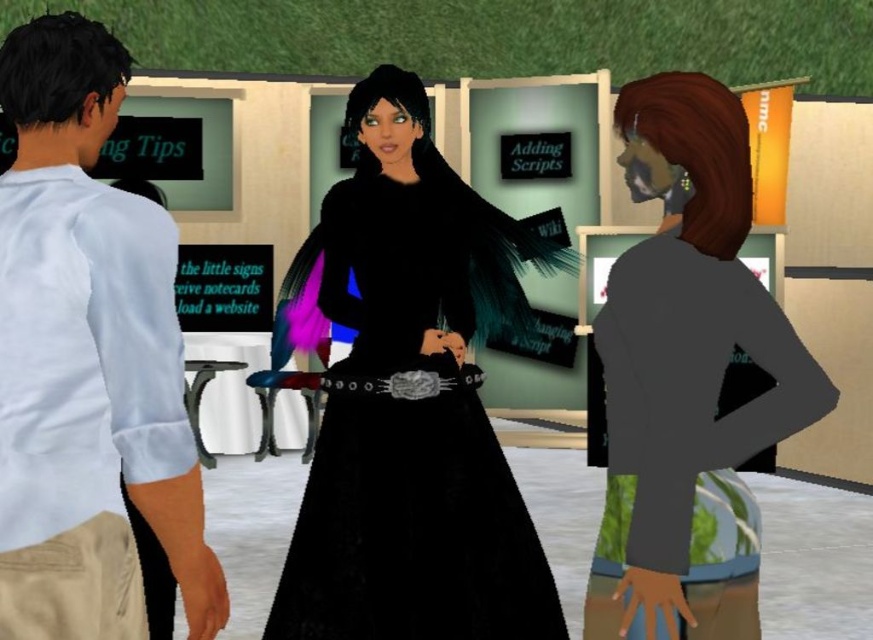
Does white cotton shirt at left appear on the left side of silver metallic belt at center?

Indeed, white cotton shirt at left is positioned on the left side of silver metallic belt at center.

This screenshot has width=873, height=640. In order to click on white cotton shirt at left in this screenshot , I will do `click(60, 92)`.

Who is more distant from viewer, (324, 266) or (482, 380)?

Positioned behind is point (324, 266).

Is black velvet dress at center behind silver metallic belt at center?

No, it is not.

Who is more distant from viewer, (382, 257) or (459, 378)?

Positioned behind is point (459, 378).

Image resolution: width=873 pixels, height=640 pixels. In order to click on black velvet dress at center in this screenshot , I will do (411, 531).

Can you confirm if matte gray jacket at right is smaller than black velvet dress at center?

Correct, matte gray jacket at right occupies less space than black velvet dress at center.

Can you confirm if matte gray jacket at right is positioned to the right of black velvet dress at center?

Indeed, matte gray jacket at right is positioned on the right side of black velvet dress at center.

Does point (715, 128) come farther from viewer compared to point (382, 483)?

That is False.

What are the coordinates of `matte gray jacket at right` in the screenshot? It's located at (686, 378).